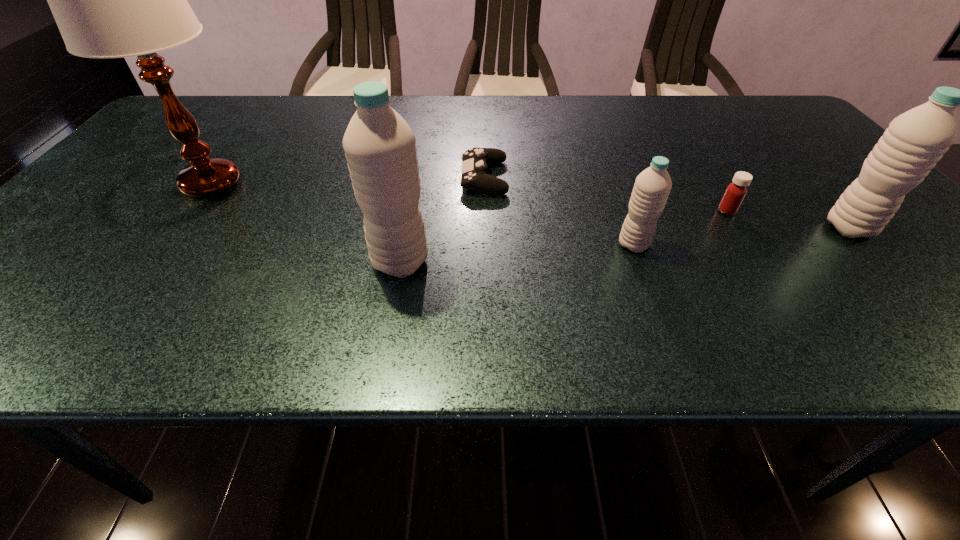
The image size is (960, 540). I want to click on the shortest object, so click(475, 160).

Identify the location of vacant space situated 0.390m on the right of the leftmost water bottle. (624, 262).

Where is `vacant space positioned 0.210m on the back of the second water bottle from left to right`? vacant space positioned 0.210m on the back of the second water bottle from left to right is located at coordinates [610, 179].

This screenshot has width=960, height=540. I want to click on vacant space located 0.400m on the left of the second tallest water bottle, so click(640, 228).

Find the location of a particular element. vacant space situated on the right of the leftmost object is located at coordinates (378, 184).

This screenshot has width=960, height=540. What are the coordinates of `vacant area situated on the right of the second object from right to left` in the screenshot? It's located at (762, 211).

The height and width of the screenshot is (540, 960). In order to click on free spot located on the surface of the shortest object in this screenshot , I will do `click(396, 178)`.

Identify the location of vacant area situated on the surface of the shortest object. This screenshot has width=960, height=540. (368, 178).

Where is `free space located 0.300m on the surface of the shortest object`? The image size is (960, 540). free space located 0.300m on the surface of the shortest object is located at coordinates (339, 178).

You are a GUI agent. You are given a task and a screenshot of the screen. Output one action in this format:
    pyautogui.click(x=<x>, y=<y>)
    Task: Click on the object present at the near edge
    
    Given the screenshot: What is the action you would take?
    pyautogui.click(x=379, y=145)